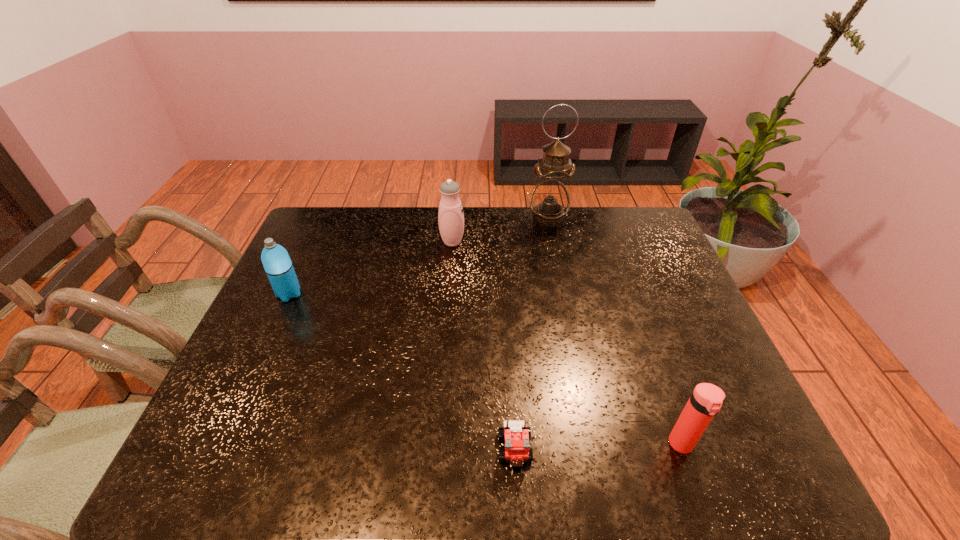
Identify the location of thermos bottle object that ranks as the closest to the farthest thermos bottle. The width and height of the screenshot is (960, 540). (276, 261).

Where is `thermos bottle that stands as the closest to the rightmost thermos bottle`? The height and width of the screenshot is (540, 960). thermos bottle that stands as the closest to the rightmost thermos bottle is located at coordinates (450, 216).

The width and height of the screenshot is (960, 540). What are the coordinates of `vacant space that satisfies the following two spatial constraints: 1. on the front side of the oil lamp; 2. on the right side of the rightmost object` in the screenshot? It's located at (594, 445).